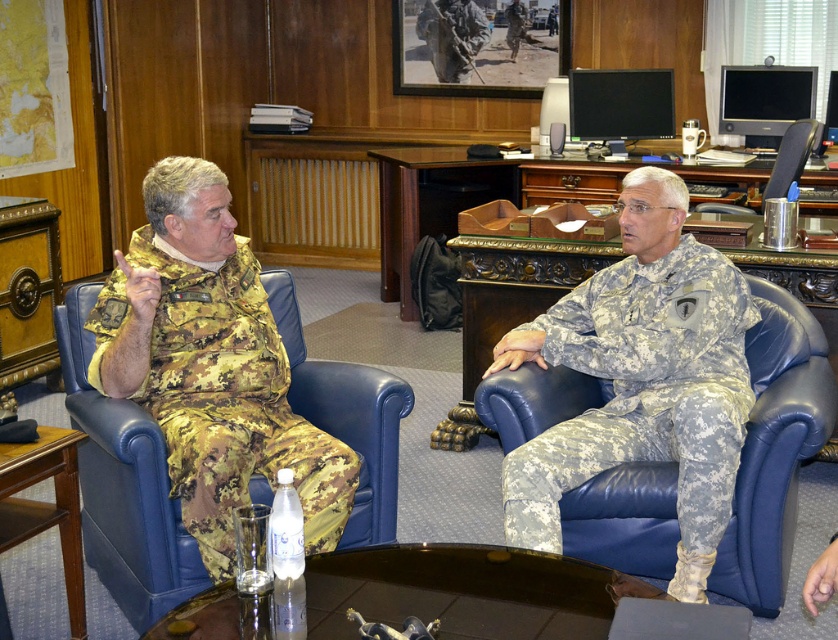
From the picture: You are standing in the office and need to reach the point marked at coordinates (221,289). The office door is 3 meters away from you. Can you walk directly to the point without needing to move around any furniture?

The point at (221,289) is 2.92 meters away from the viewer, which is just under the 3 meters to the door. Since the distance is slightly less than the door distance, you can likely walk directly to the point without needing to move around furniture, assuming no obstacles block the path.

You are an office assistant who needs to place a new document on the glossy glass table at center and the wooden table at lower left. Which table should you approach first if you are standing to the left of both tables?

You should approach the wooden table at lower left first because it is to the left of the glossy glass table at center, so it is closer to your current position.